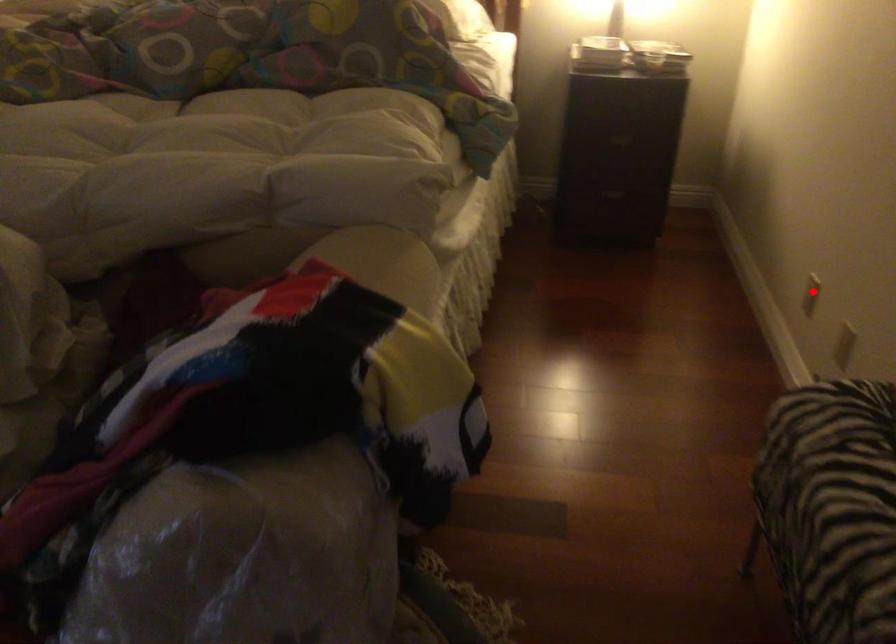
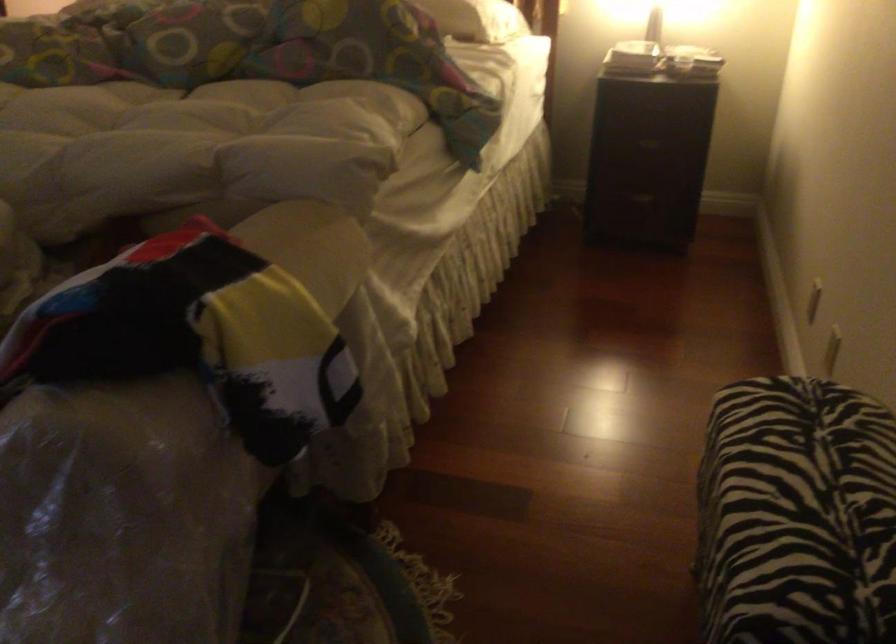
In the second image, find the point that corresponds to the highlighted location in the first image.

(814, 301)